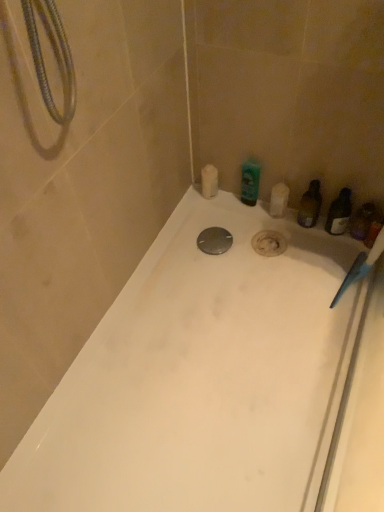
Locate an element on the screen. The image size is (384, 512). free space between white matte soap bar at upper center, the fourth toiletry positioned from the right, and metallic silver drain at center is located at coordinates (211, 224).